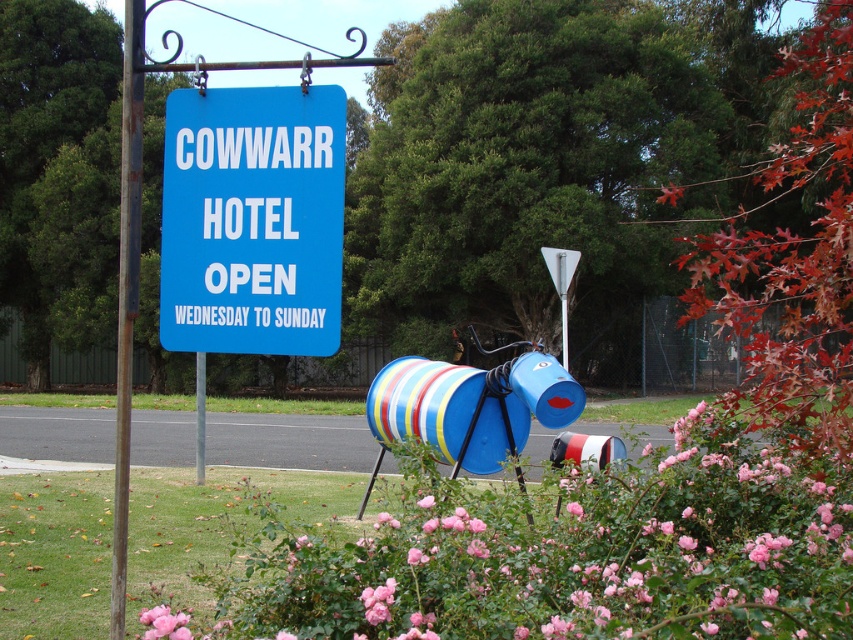
You are standing at the roadside looking at the blue hotel sign and the colorful insect sculpture. There are two points marked in the image. Which point is closer to you, point [811,484] or point [318,86]?

Point [318,86] is closer to you because point [811,484] is further away from the viewer.

You are a delivery driver who needs to deliver a package to the COWWARR HOTEL. You see the blue plastic sign at upper center indicating the hotel. Based on the sign, what days can you deliver the package?

The blue plastic sign at upper center states that COWWARR HOTEL is open from Wednesday to Sunday, so you can deliver the package on those days.

You are a painter who wants to paint both the blue plastic sign at upper center and the rusty metal pole at left. Which object requires more paint to cover its surface area?

The rusty metal pole at left requires more paint because the blue plastic sign at upper center occupies less space than it, indicating the pole has a larger surface area.